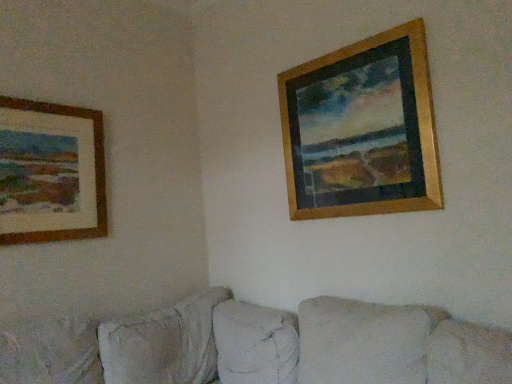
Image resolution: width=512 pixels, height=384 pixels. I want to click on wooden frame at left, which ranks as the second picture frame in right-to-left order, so click(51, 172).

The height and width of the screenshot is (384, 512). Describe the element at coordinates (51, 172) in the screenshot. I see `wooden frame at left, positioned as the 1th picture frame in left-to-right order` at that location.

The height and width of the screenshot is (384, 512). I want to click on wooden frame at left, which ranks as the second picture frame in right-to-left order, so click(x=51, y=172).

Considering the sizes of wooden frame at left, which ranks as the second picture frame in right-to-left order, and beige fabric couch at lower center in the image, is wooden frame at left, which ranks as the second picture frame in right-to-left order, bigger or smaller than beige fabric couch at lower center?

Considering their sizes, wooden frame at left, which ranks as the second picture frame in right-to-left order, takes up less space than beige fabric couch at lower center.

Is wooden frame at left, which ranks as the second picture frame in right-to-left order, oriented away from beige fabric couch at lower center?

No.

Considering the sizes of objects wooden frame at left, which ranks as the second picture frame in right-to-left order, and beige fabric couch at lower center in the image provided, who is wider, wooden frame at left, which ranks as the second picture frame in right-to-left order, or beige fabric couch at lower center?

beige fabric couch at lower center.

Which of these two, beige fabric couch at lower center or wooden frame at left, which ranks as the second picture frame in right-to-left order, is smaller?

wooden frame at left, which ranks as the second picture frame in right-to-left order.

Can you confirm if beige fabric couch at lower center is taller than wooden frame at left, positioned as the 1th picture frame in left-to-right order?

In fact, beige fabric couch at lower center may be shorter than wooden frame at left, positioned as the 1th picture frame in left-to-right order.

Is beige fabric couch at lower center at the right side of wooden frame at left, positioned as the 1th picture frame in left-to-right order?

Yes, beige fabric couch at lower center is to the right of wooden frame at left, positioned as the 1th picture frame in left-to-right order.

Is wooden frame at upper right, the 2th picture frame from the left, surrounded by wooden frame at left, which ranks as the second picture frame in right-to-left order?

That's incorrect, wooden frame at upper right, the 2th picture frame from the left, is not inside wooden frame at left, which ranks as the second picture frame in right-to-left order.

Would you consider wooden frame at left, which ranks as the second picture frame in right-to-left order, to be distant from wooden frame at upper right, which appears as the first picture frame when viewed from the right?

Absolutely, wooden frame at left, which ranks as the second picture frame in right-to-left order, is distant from wooden frame at upper right, which appears as the first picture frame when viewed from the right.

Is wooden frame at left, which ranks as the second picture frame in right-to-left order, thinner than wooden frame at upper right, which appears as the first picture frame when viewed from the right?

Indeed, wooden frame at left, which ranks as the second picture frame in right-to-left order, has a lesser width compared to wooden frame at upper right, which appears as the first picture frame when viewed from the right.

Who is taller, wooden frame at left, which ranks as the second picture frame in right-to-left order, or wooden frame at upper right, the 2th picture frame from the left?

With more height is wooden frame at upper right, the 2th picture frame from the left.

Which picture frame is the 1st one when counting from the back of the beige fabric couch at lower center? Please provide its 2D coordinates.

[(362, 129)]

Can you confirm if wooden frame at upper right, the 2th picture frame from the left, is smaller than beige fabric couch at lower center?

Yes.

Considering the positions of point (423, 63) and point (192, 322), is point (423, 63) closer or farther from the camera than point (192, 322)?

Point (423, 63).

Considering the relative positions of wooden frame at upper right, the 2th picture frame from the left, and beige fabric couch at lower center in the image provided, is wooden frame at upper right, the 2th picture frame from the left, to the left or to the right of beige fabric couch at lower center?

wooden frame at upper right, the 2th picture frame from the left, is positioned on beige fabric couch at lower center's right side.

Between point (201, 337) and point (309, 98), which one is positioned behind?

The point (201, 337) is farther from the camera.

In the image, there is a wooden frame at upper right, which appears as the first picture frame when viewed from the right. Where is `studio couch below it (from a real-world perspective)`? This screenshot has height=384, width=512. studio couch below it (from a real-world perspective) is located at coordinates point(260,346).

Which is more to the right, beige fabric couch at lower center or wooden frame at upper right, which appears as the first picture frame when viewed from the right?

wooden frame at upper right, which appears as the first picture frame when viewed from the right.

Does wooden frame at upper right, the 2th picture frame from the left, have a lesser height compared to wooden frame at left, which ranks as the second picture frame in right-to-left order?

Incorrect, the height of wooden frame at upper right, the 2th picture frame from the left, does not fall short of that of wooden frame at left, which ranks as the second picture frame in right-to-left order.

Considering the positions of point (330, 199) and point (36, 112), is point (330, 199) closer or farther from the camera than point (36, 112)?

Point (330, 199) is farther from the camera than point (36, 112).

Based on the photo, is wooden frame at upper right, the 2th picture frame from the left, to the left of wooden frame at left, positioned as the 1th picture frame in left-to-right order, from the viewer's perspective?

Incorrect, wooden frame at upper right, the 2th picture frame from the left, is not on the left side of wooden frame at left, positioned as the 1th picture frame in left-to-right order.

Find the location of a particular element. Image resolution: width=512 pixels, height=384 pixels. studio couch located on the right of wooden frame at left, which ranks as the second picture frame in right-to-left order is located at coordinates (260, 346).

At what (x,y) coordinates should I click in order to perform the action: click on studio couch below the wooden frame at left, positioned as the 1th picture frame in left-to-right order (from a real-world perspective). Please return your answer as a coordinate pair (x, y). The image size is (512, 384). Looking at the image, I should click on point(260,346).

Based on their spatial positions, is wooden frame at upper right, the 2th picture frame from the left, or wooden frame at left, which ranks as the second picture frame in right-to-left order, further from beige fabric couch at lower center?

wooden frame at left, which ranks as the second picture frame in right-to-left order.

Estimate the real-world distances between objects in this image. Which object is closer to beige fabric couch at lower center, wooden frame at left, which ranks as the second picture frame in right-to-left order, or wooden frame at upper right, the 2th picture frame from the left?

The object closer to beige fabric couch at lower center is wooden frame at upper right, the 2th picture frame from the left.

From the image, which object appears to be farther from wooden frame at upper right, the 2th picture frame from the left, beige fabric couch at lower center or wooden frame at left, which ranks as the second picture frame in right-to-left order?

Based on the image, wooden frame at left, which ranks as the second picture frame in right-to-left order, appears to be further to wooden frame at upper right, the 2th picture frame from the left.

Based on their spatial positions, is wooden frame at left, which ranks as the second picture frame in right-to-left order, or beige fabric couch at lower center closer to wooden frame at upper right, which appears as the first picture frame when viewed from the right?

beige fabric couch at lower center.

Looking at the image, which one is located further to wooden frame at left, which ranks as the second picture frame in right-to-left order, beige fabric couch at lower center or wooden frame at upper right, the 2th picture frame from the left?

Among the two, wooden frame at upper right, the 2th picture frame from the left, is located further to wooden frame at left, which ranks as the second picture frame in right-to-left order.

From the image, which object appears to be nearer to wooden frame at left, which ranks as the second picture frame in right-to-left order, wooden frame at upper right, which appears as the first picture frame when viewed from the right, or beige fabric couch at lower center?

beige fabric couch at lower center is positioned closer to the anchor wooden frame at left, which ranks as the second picture frame in right-to-left order.

This screenshot has width=512, height=384. Find the location of `studio couch between wooden frame at left, which ranks as the second picture frame in right-to-left order, and wooden frame at upper right, which appears as the first picture frame when viewed from the right, in the horizontal direction`. studio couch between wooden frame at left, which ranks as the second picture frame in right-to-left order, and wooden frame at upper right, which appears as the first picture frame when viewed from the right, in the horizontal direction is located at coordinates (260, 346).